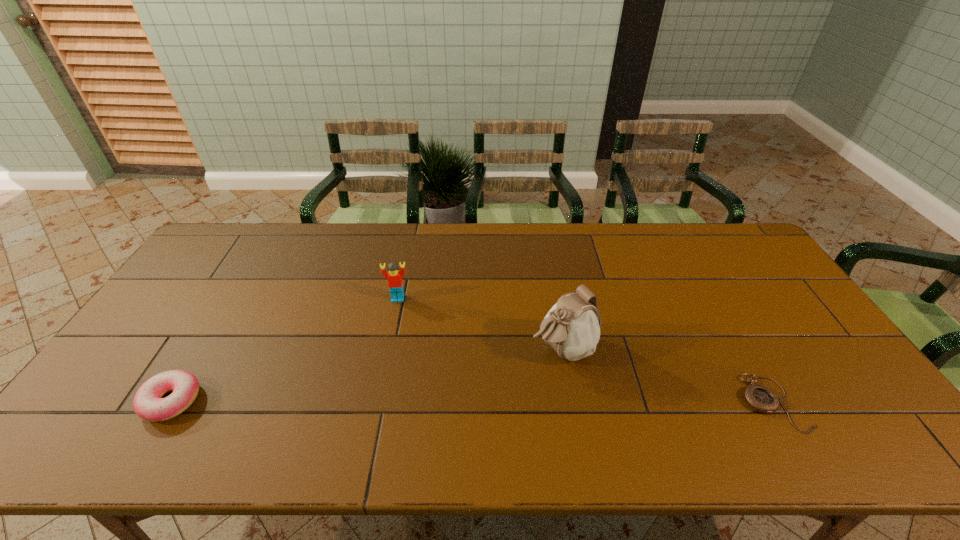
Find the location of a particular element. the third tallest object is located at coordinates (148, 405).

Identify the location of doughnut. The width and height of the screenshot is (960, 540). (148, 405).

This screenshot has height=540, width=960. In order to click on the shortest object in this screenshot , I will do pyautogui.click(x=760, y=398).

This screenshot has height=540, width=960. I want to click on the rightmost object, so click(x=760, y=398).

This screenshot has height=540, width=960. What are the coordinates of `the second object from right to left` in the screenshot? It's located at (572, 327).

In order to click on the tallest object in this screenshot , I will do `click(572, 327)`.

At what (x,y) coordinates should I click in order to perform the action: click on the third object from right to left. Please return your answer as a coordinate pair (x, y). This screenshot has height=540, width=960. Looking at the image, I should click on (394, 277).

You are a GUI agent. You are given a task and a screenshot of the screen. Output one action in this format:
    pyautogui.click(x=<x>, y=<y>)
    Task: Click on the farthest object
    The width and height of the screenshot is (960, 540).
    Given the screenshot: What is the action you would take?
    pyautogui.click(x=394, y=277)

Where is `free space located 0.140m on the right of the doughnut`? The height and width of the screenshot is (540, 960). free space located 0.140m on the right of the doughnut is located at coordinates (256, 401).

Locate an element on the screen. The image size is (960, 540). free space located on the back of the pocket watch is located at coordinates (737, 340).